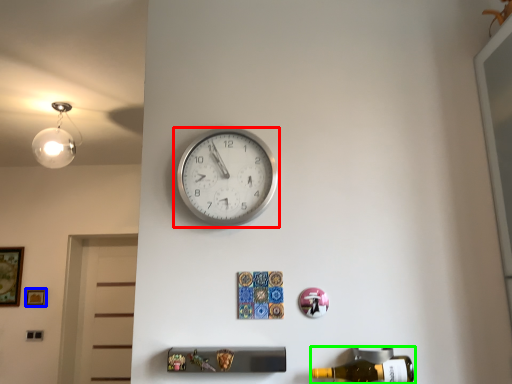
Question: Estimate the real-world distances between objects in this image. Which object is closer to wall clock (highlighted by a red box), picture frame (highlighted by a blue box) or beer bottle (highlighted by a green box)?

Choices:
 (A) picture frame
 (B) beer bottle

Answer: (B)